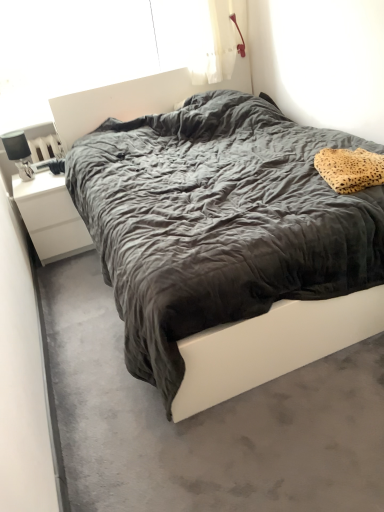
Question: Considering the positions of matte black lamp at left and leopard print fabric pillow at upper right in the image, is matte black lamp at left bigger or smaller than leopard print fabric pillow at upper right?

Choices:
 (A) big
 (B) small

Answer: (B)

Question: From a real-world perspective, is matte black lamp at left physically located above or below leopard print fabric pillow at upper right?

Choices:
 (A) above
 (B) below

Answer: (A)

Question: Which of these objects is positioned closest to the white matte nightstand at left?

Choices:
 (A) transparent plastic window screen at upper center
 (B) matte black lamp at left
 (C) velvet dark gray bed at center
 (D) dark gray fabric bed at center
 (E) leopard print fabric pillow at upper right

Answer: (B)

Question: Estimate the real-world distances between objects in this image. Which object is closer to the dark gray fabric bed at center?

Choices:
 (A) leopard print fabric pillow at upper right
 (B) transparent plastic window screen at upper center
 (C) velvet dark gray bed at center
 (D) white matte nightstand at left
 (E) matte black lamp at left

Answer: (C)